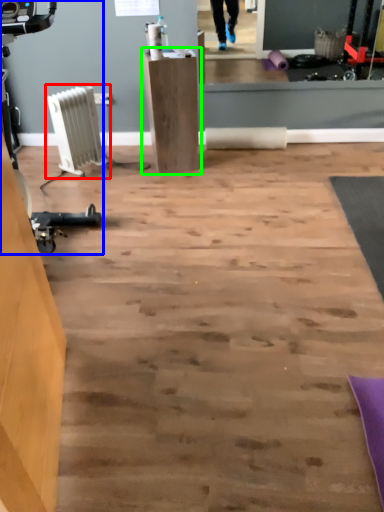
Question: Which object is the closest to the radiator (highlighted by a red box)? Choose among these: sport equipment (highlighted by a blue box) or furniture (highlighted by a green box).

Choices:
 (A) sport equipment
 (B) furniture

Answer: (B)